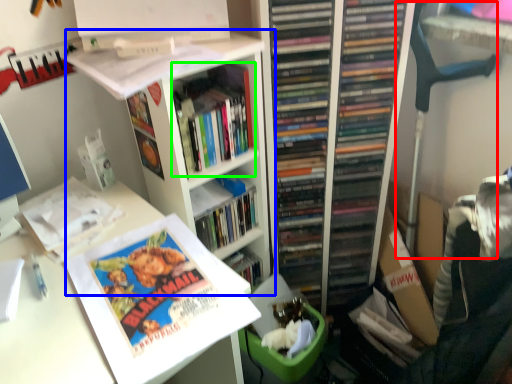
Question: Based on their relative distances, which object is farther from computer chair (highlighted by a red box)? Choose from bookshelf (highlighted by a blue box) and book (highlighted by a green box).

Choices:
 (A) bookshelf
 (B) book

Answer: (A)